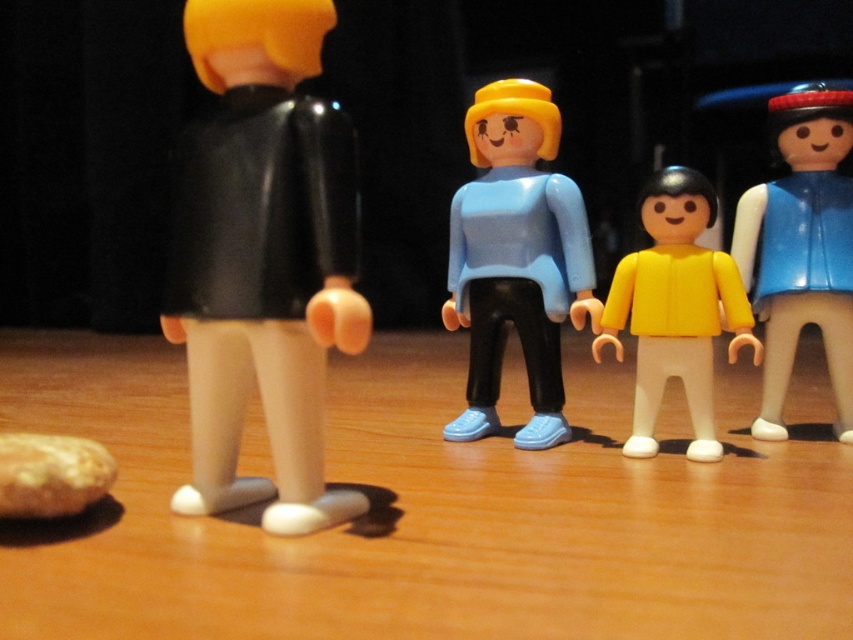
You are arranging Playmobil figurines on a table. You have a matte black figure at left and a matte blue plastic figure at center. According to the scene, which figure is positioned to the left of the other?

The matte black figure at left is to the left of the matte blue plastic figure at center.

Looking at this image, you are positioning a camera to capture the matte black figure at left and the other Playmobil figures in the scene. Based on their positions, which figure is closer to the camera?

The matte black figure at left is located at point closer to the camera than the other Playmobil figures because it is positioned at the foreground left of the scene.